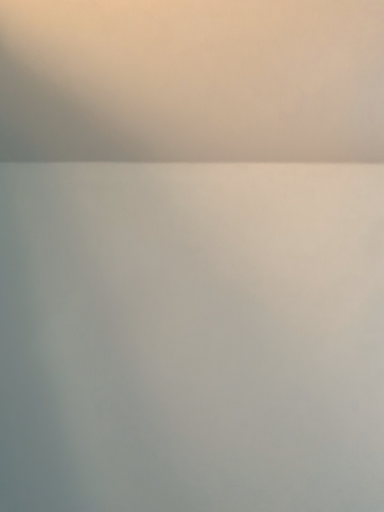
What do you see at coordinates (192, 81) in the screenshot? Image resolution: width=384 pixels, height=512 pixels. I see `matte gray cloud at upper center` at bounding box center [192, 81].

The width and height of the screenshot is (384, 512). I want to click on matte gray cloud at upper center, so click(192, 81).

Where is `matte gray cloud at upper center`? This screenshot has height=512, width=384. matte gray cloud at upper center is located at coordinates (192, 81).